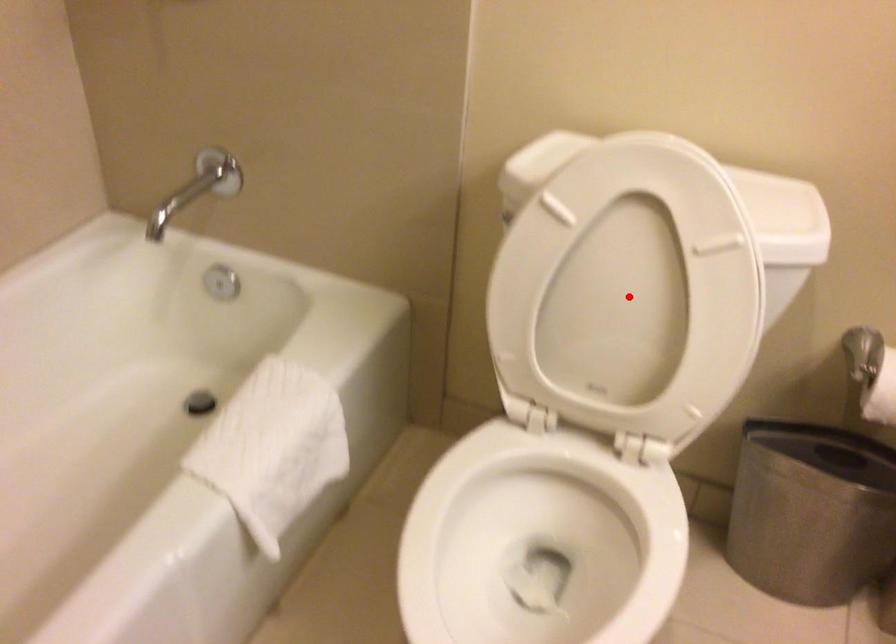
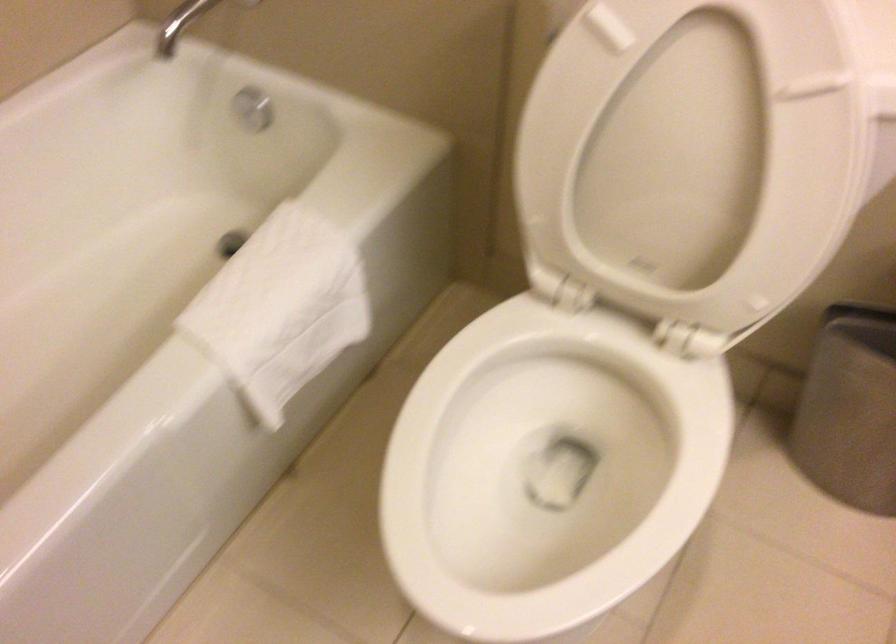
Locate, in the second image, the point that corresponds to the highlighted location in the first image.

(691, 154)